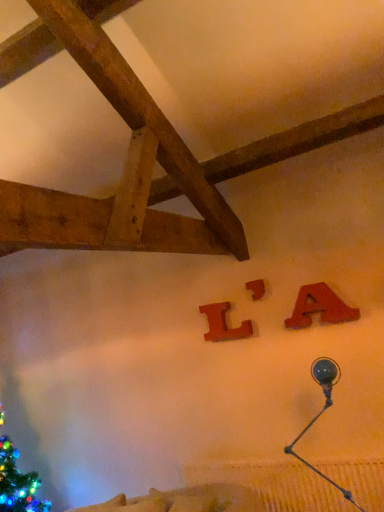
Question: Would you say matte wood letter a at upper right, arranged as the third alphabet when viewed from the back, is inside or outside metallic blue lamp at upper right?

Choices:
 (A) inside
 (B) outside

Answer: (B)

Question: Is matte wood letter a at upper right, the first alphabet viewed from the right, taller or shorter than metallic blue lamp at upper right?

Choices:
 (A) short
 (B) tall

Answer: (A)

Question: Which object is the farthest from the matte wood letter at center, the second alphabet in the left-to-right sequence?

Choices:
 (A) metallic blue lamp at upper right
 (B) matte wood letter a at upper right, the third alphabet from the left
 (C) wooden letter l at center, acting as the 3th alphabet starting from the front

Answer: (A)

Question: Considering the real-world distances, which object is closest to the metallic blue lamp at upper right?

Choices:
 (A) matte wood letter at center, which ranks as the second alphabet in right-to-left order
 (B) matte wood letter a at upper right, which is the first alphabet from front to back
 (C) wooden letter l at center, the first alphabet from the left

Answer: (B)